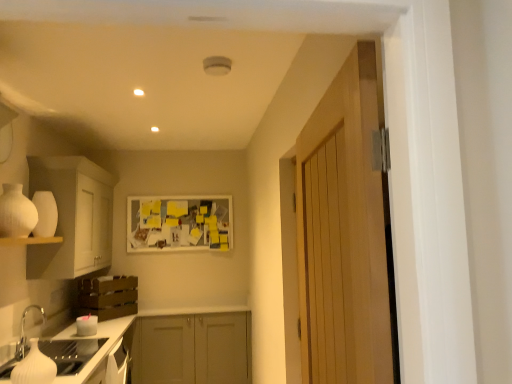
Describe the element at coordinates (346, 232) in the screenshot. The image size is (512, 384). I see `wooden door at right` at that location.

You are a GUI agent. You are given a task and a screenshot of the screen. Output one action in this format:
    pyautogui.click(x=<x>, y=<y>)
    Task: Click on the wooden door at right
    This screenshot has height=384, width=512.
    Given the screenshot: What is the action you would take?
    pyautogui.click(x=346, y=232)

The width and height of the screenshot is (512, 384). What do you see at coordinates (179, 223) in the screenshot? I see `yellow paper at center` at bounding box center [179, 223].

Where is `white glossy countertop at lower left`? The image size is (512, 384). white glossy countertop at lower left is located at coordinates (100, 349).

What do you see at coordinates (73, 217) in the screenshot? This screenshot has width=512, height=384. I see `white matte cabinet at left, which is the first cabinetry in top-to-bottom order` at bounding box center [73, 217].

Locate an element on the screen. Image resolution: width=512 pixels, height=384 pixels. wooden door at right is located at coordinates (346, 232).

Is white glossy countertop at lower left inside the boundaries of white matte vase at left, or outside?

white glossy countertop at lower left exists outside the volume of white matte vase at left.

From the image's perspective, which one is positioned higher, white glossy countertop at lower left or white matte vase at left?

white matte vase at left appears higher in the image.

Can you confirm if white glossy countertop at lower left is thinner than white matte vase at left?

In fact, white glossy countertop at lower left might be wider than white matte vase at left.

Are white glossy countertop at lower left and white matte vase at left making contact?

No, white glossy countertop at lower left is not beside white matte vase at left.

Is yellow paper at center wider than matte gray cabinets at center, which is the first cabinetry in bottom-to-top order?

Incorrect, the width of yellow paper at center does not surpass that of matte gray cabinets at center, which is the first cabinetry in bottom-to-top order.

Is yellow paper at center spatially inside matte gray cabinets at center, which is the first cabinetry in bottom-to-top order, or outside of it?

yellow paper at center is not enclosed by matte gray cabinets at center, which is the first cabinetry in bottom-to-top order.

Which object is more forward, yellow paper at center or matte gray cabinets at center, which is the first cabinetry in bottom-to-top order?

Positioned in front is matte gray cabinets at center, which is the first cabinetry in bottom-to-top order.

Locate an element on the screen. This screenshot has height=384, width=512. countertop beneath the white matte cabinet at left, which is the 3th cabinetry from bottom to top (from a real-world perspective) is located at coordinates (100, 349).

Looking at this image, from the image's perspective, is white matte cabinet at left, which is the first cabinetry in top-to-bottom order, on top of white glossy countertop at lower left?

Correct, white matte cabinet at left, which is the first cabinetry in top-to-bottom order, appears higher than white glossy countertop at lower left in the image.

Is white matte cabinet at left, which is the 3th cabinetry from bottom to top, to the left or to the right of white glossy countertop at lower left in the image?

white matte cabinet at left, which is the 3th cabinetry from bottom to top, is to the left of white glossy countertop at lower left.

Which object is closer to the camera, white matte cabinet at left, which is the first cabinetry in top-to-bottom order, or white glossy countertop at lower left?

white glossy countertop at lower left is in front.

Is matte gray cabinets at center, positioned as the third cabinetry in top-to-bottom order, not near white glossy sink at lower left?

Yes, matte gray cabinets at center, positioned as the third cabinetry in top-to-bottom order, and white glossy sink at lower left are quite far apart.

Considering the relative sizes of matte gray cabinets at center, which is the first cabinetry in bottom-to-top order, and white glossy sink at lower left in the image provided, is matte gray cabinets at center, which is the first cabinetry in bottom-to-top order, taller than white glossy sink at lower left?

Indeed, matte gray cabinets at center, which is the first cabinetry in bottom-to-top order, has a greater height compared to white glossy sink at lower left.

From a real-world perspective, which is physically above, matte gray cabinets at center, which is the first cabinetry in bottom-to-top order, or white glossy sink at lower left?

white glossy sink at lower left.

Is matte gray cabinets at center, positioned as the third cabinetry in top-to-bottom order, in front of or behind white glossy sink at lower left in the image?

Visually, matte gray cabinets at center, positioned as the third cabinetry in top-to-bottom order, is located behind white glossy sink at lower left.

From the image's perspective, is white glossy countertop at lower left beneath wooden door at right?

Correct, white glossy countertop at lower left appears lower than wooden door at right in the image.

Would you say white glossy countertop at lower left is outside wooden door at right?

Absolutely, white glossy countertop at lower left is external to wooden door at right.

Which point is more distant from viewer, (103, 351) or (343, 138)?

The point (103, 351) is behind.

In the scene shown: Would you say white glossy countertop at lower left is to the left or to the right of wooden door at right in the picture?

In the image, white glossy countertop at lower left appears on the left side of wooden door at right.

Does white matte cabinet at left, which is the 3th cabinetry from bottom to top, have a greater width compared to white glossy sink at lower left?

Indeed, white matte cabinet at left, which is the 3th cabinetry from bottom to top, has a greater width compared to white glossy sink at lower left.

Which is in front, white matte cabinet at left, which is the 3th cabinetry from bottom to top, or white glossy sink at lower left?

white glossy sink at lower left is closer to the camera.

Is white matte cabinet at left, which is the first cabinetry in top-to-bottom order, facing away from white glossy sink at lower left?

That's not correct — white matte cabinet at left, which is the first cabinetry in top-to-bottom order, is not looking away from white glossy sink at lower left.

Based on the photo, from the image's perspective, is yellow paper at center over white glossy sink at lower left?

Yes.

Is white glossy sink at lower left located within yellow paper at center?

Actually, white glossy sink at lower left is outside yellow paper at center.

From a real-world perspective, is yellow paper at center positioned above or below white glossy sink at lower left?

From a real-world perspective, yellow paper at center is physically above white glossy sink at lower left.

Considering the sizes of objects yellow paper at center and white glossy sink at lower left in the image provided, who is wider, yellow paper at center or white glossy sink at lower left?

With larger width is white glossy sink at lower left.

Locate an element on the screen. appliance above the white glossy countertop at lower left (from a real-world perspective) is located at coordinates (16, 212).

This screenshot has height=384, width=512. I want to click on cabinetry that is the 1st one when counting forward from the yellow paper at center, so click(192, 349).

Looking at the image, which one is located closer to white matte cabinet at left, which is the 3th cabinetry from bottom to top, white matte vase at left or white matte shelf at lower left?

The object closer to white matte cabinet at left, which is the 3th cabinetry from bottom to top, is white matte shelf at lower left.

When comparing their distances from wooden door at right, does white matte vase at left or yellow paper at center seem further?

yellow paper at center is further to wooden door at right.

Estimate the real-world distances between objects in this image. Which object is closer to yellow paper at center, matte gray cabinets at center, which is the first cabinetry in bottom-to-top order, or white matte cabinet at left, which is the first cabinetry in top-to-bottom order?

Among the two, matte gray cabinets at center, which is the first cabinetry in bottom-to-top order, is located nearer to yellow paper at center.

Based on their spatial positions, is white matte cabinet at left, which is the first cabinetry in top-to-bottom order, or brown wooden crate at lower left, which appears as the second cabinetry when viewed from the top, closer to white glossy countertop at lower left?

brown wooden crate at lower left, which appears as the second cabinetry when viewed from the top, lies closer to white glossy countertop at lower left than the other object.

Estimate the real-world distances between objects in this image. Which object is closer to white matte vase at left, matte gray cabinets at center, positioned as the third cabinetry in top-to-bottom order, or white glossy countertop at lower left?

white glossy countertop at lower left is positioned closer to the anchor white matte vase at left.

Consider the image. Based on their spatial positions, is matte gray cabinets at center, positioned as the third cabinetry in top-to-bottom order, or white matte cabinet at left, which is the 3th cabinetry from bottom to top, closer to white matte vase at left?

white matte cabinet at left, which is the 3th cabinetry from bottom to top, is closer to white matte vase at left.

Which object lies nearer to the anchor point white matte vase at left, white glossy countertop at lower left or white matte shelf at lower left?

white matte shelf at lower left lies closer to white matte vase at left than the other object.

Which object lies nearer to the anchor point wooden door at right, white matte cabinet at left, which is the first cabinetry in top-to-bottom order, or yellow paper at center?

white matte cabinet at left, which is the first cabinetry in top-to-bottom order, is positioned closer to the anchor wooden door at right.

Identify the location of cabinetry that lies between white matte vase at left and white glossy sink at lower left from top to bottom. (73, 217).

Identify the location of countertop positioned between wooden door at right and matte gray cabinets at center, positioned as the third cabinetry in top-to-bottom order, from near to far. (100, 349).

Identify the location of sink between white matte vase at left and brown wooden crate at lower left, which is counted as the second cabinetry, starting from the bottom, from front to back. The image size is (512, 384). (33, 359).

The image size is (512, 384). I want to click on appliance between wooden door at right and matte gray cabinets at center, which is the first cabinetry in bottom-to-top order, in the front-back direction, so [x=16, y=212].